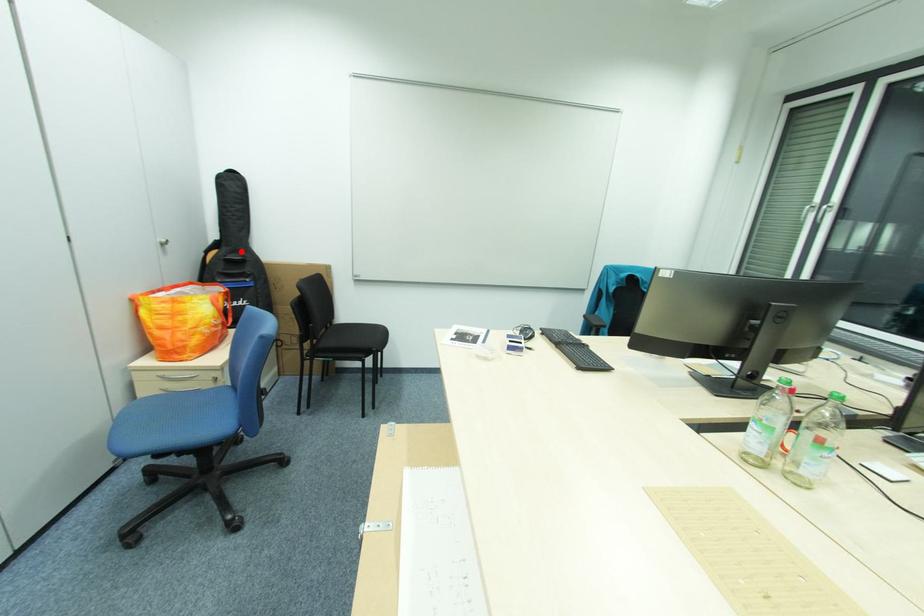
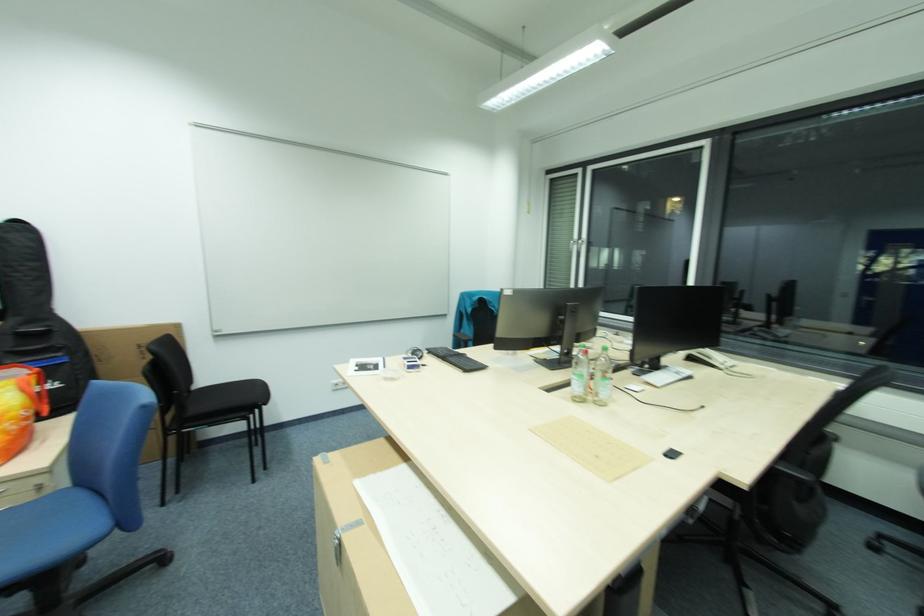
Where in the second image is the point corresponding to the highlighted location from the first image?

(41, 322)